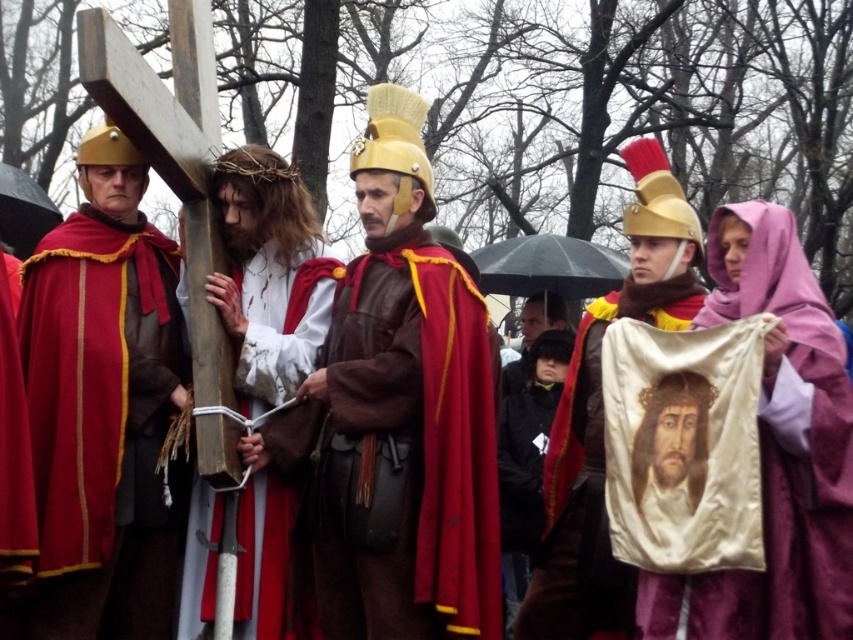
Question: Which object is the farthest from the matte gold helmet at left?

Choices:
 (A) smooth white cloth at center
 (B) leather helmet at center

Answer: (A)

Question: Where is leather helmet at center located in relation to smooth white cloth at center in the image?

Choices:
 (A) above
 (B) below

Answer: (A)

Question: Which of these objects is positioned farthest from the smooth white cloth at center?

Choices:
 (A) leather helmet at center
 (B) matte gold helmet at center

Answer: (A)

Question: Which of the following is the closest to the observer?

Choices:
 (A) (688, 445)
 (B) (734, 593)
 (C) (151, 365)

Answer: (B)

Question: Does wooden cross at center have a smaller size compared to smooth white cloth at center?

Choices:
 (A) no
 (B) yes

Answer: (A)

Question: Is purple velvet veil at upper right above matte gold helmet at center?

Choices:
 (A) no
 (B) yes

Answer: (B)